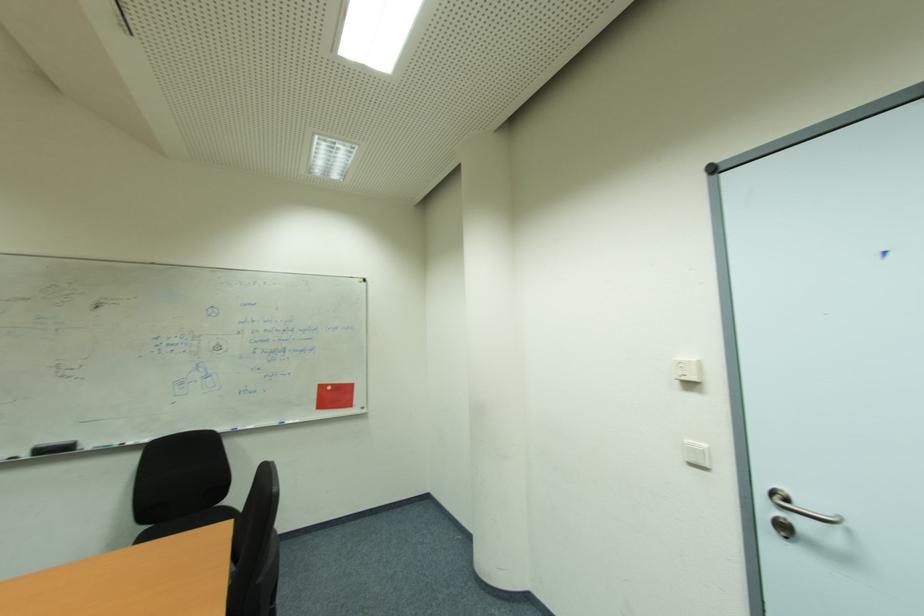
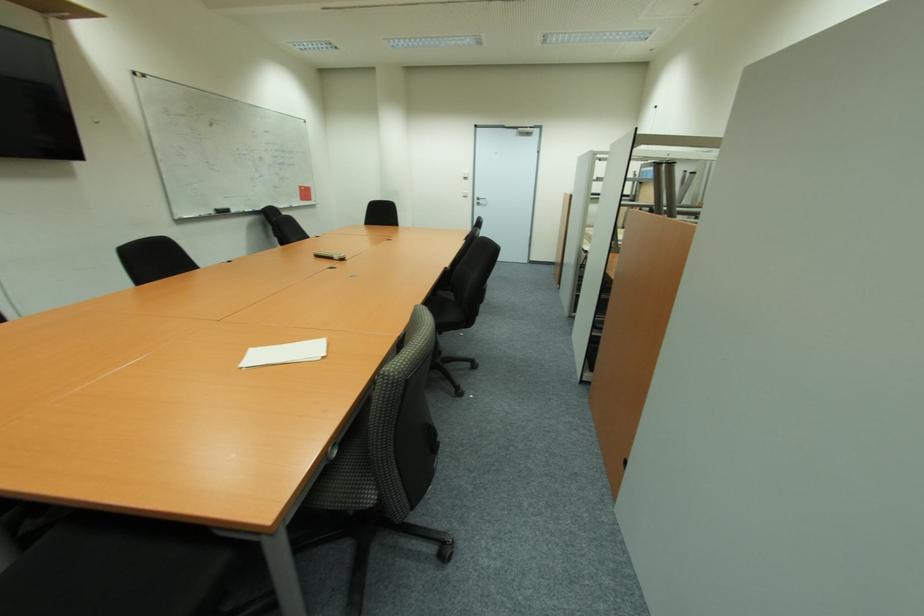
In the second image, find the point that corresponds to point (681, 384) in the first image.

(467, 179)